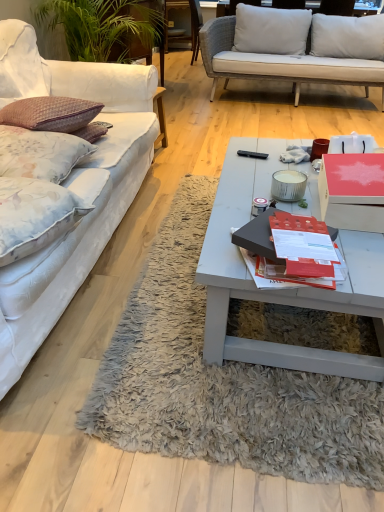
Question: From the image's perspective, is white fabric couch at left on wooden chair at upper center?

Choices:
 (A) no
 (B) yes

Answer: (A)

Question: Is white fabric couch at left positioned with its back to wooden chair at upper center?

Choices:
 (A) yes
 (B) no

Answer: (B)

Question: Is white fabric couch at left aimed at wooden chair at upper center?

Choices:
 (A) no
 (B) yes

Answer: (A)

Question: Would you consider white fabric couch at left to be distant from wooden chair at upper center?

Choices:
 (A) yes
 (B) no

Answer: (A)

Question: Is white fabric couch at left next to wooden chair at upper center?

Choices:
 (A) yes
 (B) no

Answer: (B)

Question: Considering their positions, is matte black book at center located in front of or behind white fabric couch at left?

Choices:
 (A) front
 (B) behind

Answer: (B)

Question: Considering the positions of matte black book at center and white fabric couch at left in the image, is matte black book at center bigger or smaller than white fabric couch at left?

Choices:
 (A) big
 (B) small

Answer: (B)

Question: Considering the relative positions of matte black book at center and white fabric couch at left in the image provided, is matte black book at center to the left or to the right of white fabric couch at left?

Choices:
 (A) left
 (B) right

Answer: (B)

Question: Choose the correct answer: Is matte black book at center inside white fabric couch at left or outside it?

Choices:
 (A) inside
 (B) outside

Answer: (B)

Question: Looking at their shapes, would you say white fabric couch at left is wider or thinner than matte black book at center?

Choices:
 (A) thin
 (B) wide

Answer: (B)

Question: From the image's perspective, is white fabric couch at left above or below matte black book at center?

Choices:
 (A) above
 (B) below

Answer: (A)

Question: Is point (39, 336) positioned closer to the camera than point (249, 246)?

Choices:
 (A) farther
 (B) closer

Answer: (A)

Question: From a real-world perspective, is white fabric couch at left above or below matte black book at center?

Choices:
 (A) below
 (B) above

Answer: (A)

Question: Looking at their shapes, would you say matte black book at center is wider or thinner than floral fabric pillow at left, arranged as the 1th pillow when viewed from the front?

Choices:
 (A) wide
 (B) thin

Answer: (B)

Question: Is matte black book at center bigger or smaller than floral fabric pillow at left, arranged as the 1th pillow when viewed from the front?

Choices:
 (A) small
 (B) big

Answer: (A)